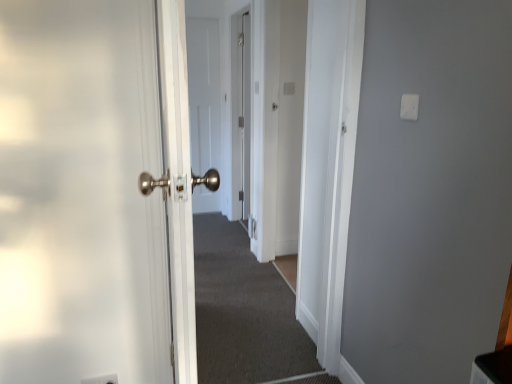
Question: Would you say carpeted corridor at center is to the left or to the right of white plastic light switch at upper right in the picture?

Choices:
 (A) left
 (B) right

Answer: (A)

Question: Is point (263, 281) closer or farther from the camera than point (400, 99)?

Choices:
 (A) farther
 (B) closer

Answer: (A)

Question: Considering the real-world distances, which object is farthest from the carpeted corridor at center?

Choices:
 (A) white matte door at center
 (B) white plastic electric outlet at lower left
 (C) white plastic light switch at upper right

Answer: (C)

Question: Which is farther from the white plastic electric outlet at lower left?

Choices:
 (A) white plastic light switch at upper right
 (B) carpeted corridor at center
 (C) white matte door at center

Answer: (C)